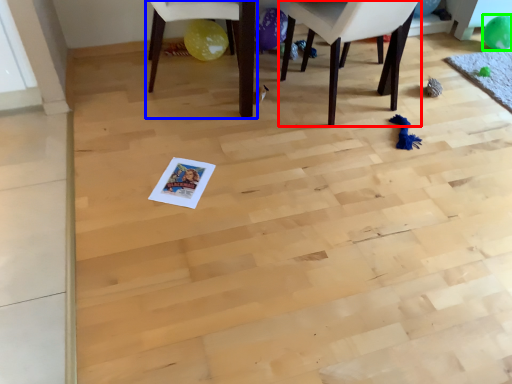
Question: Which object is the closest to the chair (highlighted by a red box)? Choose among these: chair (highlighted by a blue box) or balloon (highlighted by a green box).

Choices:
 (A) chair
 (B) balloon

Answer: (A)